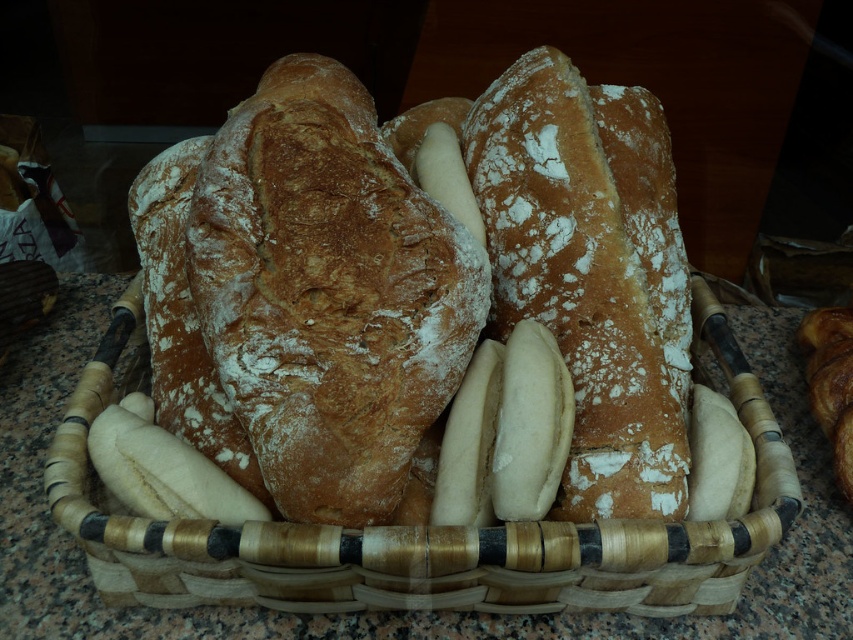
Is golden brown crusty loaf at center smaller than brown woven basket at center?

Actually, golden brown crusty loaf at center might be larger than brown woven basket at center.

Can you confirm if golden brown crusty loaf at center is wider than brown woven basket at center?

In fact, golden brown crusty loaf at center might be narrower than brown woven basket at center.

I want to click on golden brown crusty loaf at center, so click(x=306, y=291).

Who is taller, golden brown crusty loaf at center or golden crusty loaf at center?

golden crusty loaf at center is taller.

Can you confirm if golden brown crusty loaf at center is smaller than golden crusty loaf at center?

Actually, golden brown crusty loaf at center might be larger than golden crusty loaf at center.

Is point (447, 237) in front of point (492, 316)?

Yes, point (447, 237) is in front of point (492, 316).

Where is `golden brown crusty loaf at center`? The width and height of the screenshot is (853, 640). golden brown crusty loaf at center is located at coordinates (306, 291).

Is golden crusty loaf at center bigger than brown woven basket at center?

No, golden crusty loaf at center is not bigger than brown woven basket at center.

Which is behind, point (503, 339) or point (207, 547)?

Point (503, 339)

Between point (584, 358) and point (273, 524), which one is positioned behind?

Point (584, 358)

At what (x,y) coordinates should I click in order to perform the action: click on golden crusty loaf at center. Please return your answer as a coordinate pair (x, y). Image resolution: width=853 pixels, height=640 pixels. Looking at the image, I should click on (590, 272).